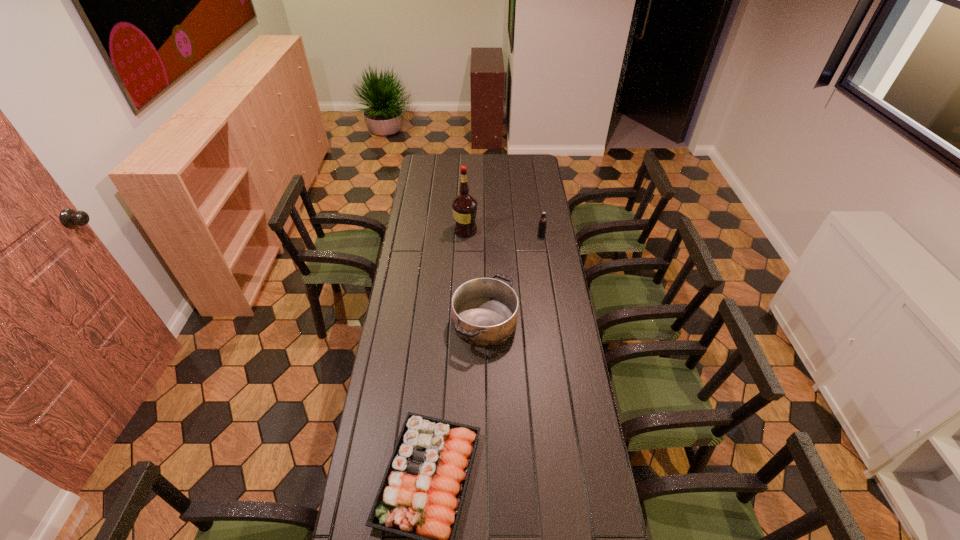
You are a GUI agent. You are given a task and a screenshot of the screen. Output one action in this format:
    pyautogui.click(x=<x>, y=<y>)
    Task: Click on the free space at the far left corner of the desktop
    The height and width of the screenshot is (540, 960).
    Given the screenshot: What is the action you would take?
    pyautogui.click(x=426, y=175)

I want to click on vacant area that lies between the rightmost object and the tallest object, so click(503, 233).

Find the location of a particular element. Image resolution: width=960 pixels, height=540 pixels. free space between the third farthest object and the rightmost object is located at coordinates (513, 279).

Where is `free spot between the pop and the second nearest object`? free spot between the pop and the second nearest object is located at coordinates coord(513,279).

Locate an element on the screen. The height and width of the screenshot is (540, 960). vacant space in between the pop and the saucepan is located at coordinates (513, 279).

You are a GUI agent. You are given a task and a screenshot of the screen. Output one action in this format:
    pyautogui.click(x=<x>, y=<y>)
    Task: Click on the vacant region between the second nearest object and the alcohol
    The width and height of the screenshot is (960, 540).
    Given the screenshot: What is the action you would take?
    pyautogui.click(x=475, y=276)

Image resolution: width=960 pixels, height=540 pixels. I want to click on vacant space in between the rightmost object and the tallest object, so tap(503, 233).

Where is `object that stands as the second closest to the platter`? The image size is (960, 540). object that stands as the second closest to the platter is located at coordinates (464, 206).

You are a GUI agent. You are given a task and a screenshot of the screen. Output one action in this format:
    pyautogui.click(x=<x>, y=<y>)
    Task: Click on the object that is the third closest to the third farthest object
    This screenshot has height=540, width=960.
    Given the screenshot: What is the action you would take?
    pyautogui.click(x=542, y=224)

I want to click on free point that satisfies the following two spatial constraints: 1. on the label of the alcohol; 2. on the right side of the third farthest object, so click(462, 321).